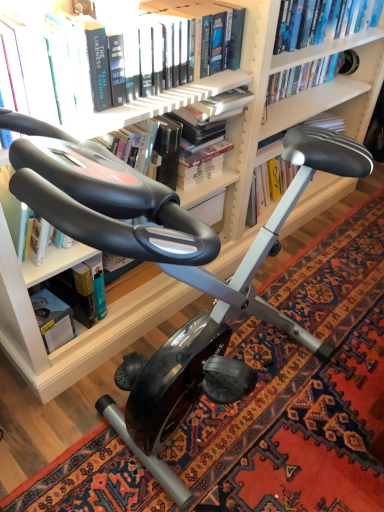
Question: Would you say black rubber exercise bike at center is to the left or to the right of hardcover book at upper center, the 1th book from the back, in the picture?

Choices:
 (A) right
 (B) left

Answer: (B)

Question: From a real-world perspective, is black rubber exercise bike at center positioned above or below hardcover book at upper center, the 1th book from the back?

Choices:
 (A) below
 (B) above

Answer: (A)

Question: Which is farther from the hardcover book at lower left?

Choices:
 (A) hardcover book at left, the 2th book positioned from the back
 (B) hardcover book at center, positioned as the 2th book in front-to-back order
 (C) hardcover book at upper center, the 1th book from the front
 (D) hardcover book at upper center, which appears as the 4th book when viewed from the front
 (E) black rubber exercise bike at center

Answer: (D)

Question: Which is farther from the hardcover book at lower left?

Choices:
 (A) hardcover book at upper center, acting as the fourth book starting from the back
 (B) black rubber exercise bike at center
 (C) hardcover book at upper center, which appears as the 4th book when viewed from the front
 (D) hardcover book at center, the 3th book positioned from the back
 (E) hardcover book at left, the 2th book positioned from the back

Answer: (C)